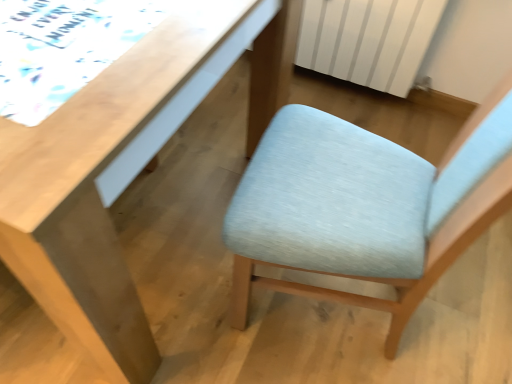
Question: Is white striped radiator at upper right far from light wood desk at upper left?

Choices:
 (A) yes
 (B) no

Answer: (A)

Question: Is white striped radiator at upper right in front of light wood desk at upper left?

Choices:
 (A) no
 (B) yes

Answer: (A)

Question: Is white striped radiator at upper right turned away from light wood desk at upper left?

Choices:
 (A) yes
 (B) no

Answer: (B)

Question: Is white striped radiator at upper right at the left side of light wood desk at upper left?

Choices:
 (A) yes
 (B) no

Answer: (B)

Question: From the image's perspective, is white striped radiator at upper right on top of light wood desk at upper left?

Choices:
 (A) no
 (B) yes

Answer: (B)

Question: Is white striped radiator at upper right in front of or behind light wood desk at upper left in the image?

Choices:
 (A) behind
 (B) front

Answer: (A)

Question: Is white striped radiator at upper right inside the boundaries of light wood desk at upper left, or outside?

Choices:
 (A) outside
 (B) inside

Answer: (A)

Question: Is point (371, 1) positioned closer to the camera than point (22, 140)?

Choices:
 (A) farther
 (B) closer

Answer: (A)

Question: In terms of width, does white striped radiator at upper right look wider or thinner when compared to light wood desk at upper left?

Choices:
 (A) thin
 (B) wide

Answer: (A)

Question: From the image's perspective, relative to light wood desk at upper left, is light blue fabric chair at center above or below?

Choices:
 (A) above
 (B) below

Answer: (B)

Question: Considering the positions of light blue fabric chair at center and light wood desk at upper left in the image, is light blue fabric chair at center taller or shorter than light wood desk at upper left?

Choices:
 (A) tall
 (B) short

Answer: (A)

Question: In terms of width, does light blue fabric chair at center look wider or thinner when compared to light wood desk at upper left?

Choices:
 (A) thin
 (B) wide

Answer: (A)

Question: Considering the relative positions of light blue fabric chair at center and light wood desk at upper left in the image provided, is light blue fabric chair at center to the left or to the right of light wood desk at upper left?

Choices:
 (A) right
 (B) left

Answer: (A)

Question: In terms of height, does light wood desk at upper left look taller or shorter compared to light blue fabric chair at center?

Choices:
 (A) tall
 (B) short

Answer: (B)

Question: Is light wood desk at upper left situated inside light blue fabric chair at center or outside?

Choices:
 (A) inside
 (B) outside

Answer: (B)